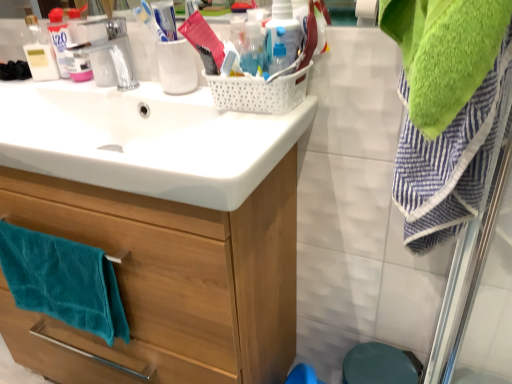
What do you see at coordinates (278, 55) in the screenshot?
I see `translucent plastic bottle at upper center, placed as the second bottle when sorted from left to right` at bounding box center [278, 55].

In order to click on wooden cabinet at center in this screenshot , I will do `click(169, 281)`.

Considering the relative positions of translucent plastic bottle at upper center, which is the first bottle in left-to-right order, and translucent plastic bottle at upper center, placed as the second bottle when sorted from left to right, in the image provided, is translucent plastic bottle at upper center, which is the first bottle in left-to-right order, in front of translucent plastic bottle at upper center, placed as the second bottle when sorted from left to right,?

That is False.

Considering the positions of objects translucent plastic bottle at upper center, the second bottle viewed from the right, and translucent plastic bottle at upper center, placed as the second bottle when sorted from left to right, in the image provided, who is more to the left, translucent plastic bottle at upper center, the second bottle viewed from the right, or translucent plastic bottle at upper center, placed as the second bottle when sorted from left to right,?

translucent plastic bottle at upper center, the second bottle viewed from the right.

Considering the sizes of translucent plastic bottle at upper center, which is the first bottle in left-to-right order, and translucent plastic bottle at upper center, placed as the second bottle when sorted from left to right, in the image, is translucent plastic bottle at upper center, which is the first bottle in left-to-right order, bigger or smaller than translucent plastic bottle at upper center, placed as the second bottle when sorted from left to right,?

Clearly, translucent plastic bottle at upper center, which is the first bottle in left-to-right order, is larger in size than translucent plastic bottle at upper center, placed as the second bottle when sorted from left to right.

How many degrees apart are the facing directions of translucent plastic bottle at upper center, which is the first bottle in left-to-right order, and translucent plastic bottle at upper center, placed as the second bottle when sorted from left to right?

The angular difference between translucent plastic bottle at upper center, which is the first bottle in left-to-right order, and translucent plastic bottle at upper center, placed as the second bottle when sorted from left to right, is 0.00407 degrees.

Does teal soft towel at lower left turn towards wooden cabinet at center?

No, teal soft towel at lower left does not turn towards wooden cabinet at center.

Do you think teal soft towel at lower left is within wooden cabinet at center, or outside of it?

teal soft towel at lower left is not inside wooden cabinet at center, it's outside.

Can you confirm if teal soft towel at lower left is positioned to the left of wooden cabinet at center?

Yes, teal soft towel at lower left is to the left of wooden cabinet at center.

From the image's perspective, which is below, teal soft towel at lower left or wooden cabinet at center?

wooden cabinet at center, from the image's perspective.

The width and height of the screenshot is (512, 384). In the image, there is a teal soft towel at lower left. Identify the location of sink above it (from the image's perspective). (145, 140).

From the image's perspective, who appears lower, white glossy sink at upper center or teal soft towel at lower left?

From the image's view, teal soft towel at lower left is below.

Who is shorter, white glossy sink at upper center or teal soft towel at lower left?

white glossy sink at upper center is shorter.

Who is more distant, white glossy sink at upper center or translucent plastic bottle at upper center, which is the first bottle in left-to-right order?

Positioned behind is translucent plastic bottle at upper center, which is the first bottle in left-to-right order.

Is white glossy sink at upper center directly adjacent to translucent plastic bottle at upper center, the second bottle viewed from the right?

There is a gap between white glossy sink at upper center and translucent plastic bottle at upper center, the second bottle viewed from the right.

Is point (210, 168) closer to camera compared to point (249, 33)?

That is True.

Between white glossy sink at upper center and translucent plastic bottle at upper center, the second bottle viewed from the right, which one has smaller size?

Smaller between the two is translucent plastic bottle at upper center, the second bottle viewed from the right.

What are the coordinates of `sink that appears on the left of wooden cabinet at center` in the screenshot? It's located at (145, 140).

Is point (192, 129) positioned behind point (287, 322)?

No.

Which of these two, white glossy sink at upper center or wooden cabinet at center, is bigger?

Bigger between the two is wooden cabinet at center.

This screenshot has height=384, width=512. I want to click on the 1st bottle above when counting from the teal soft towel at lower left (from the image's perspective), so click(278, 55).

Would you say translucent plastic bottle at upper center, placed as the second bottle when sorted from left to right, is to the left or to the right of teal soft towel at lower left in the picture?

translucent plastic bottle at upper center, placed as the second bottle when sorted from left to right, is to the right of teal soft towel at lower left.

Is translucent plastic bottle at upper center, placed as the second bottle when sorted from left to right, positioned in front of teal soft towel at lower left?

Yes.

Looking at their sizes, would you say translucent plastic bottle at upper center, the 1th bottle from the right, is wider or thinner than teal soft towel at lower left?

translucent plastic bottle at upper center, the 1th bottle from the right, is thinner than teal soft towel at lower left.

From the image's perspective, which one is positioned higher, wooden cabinet at center or translucent plastic bottle at upper center, which is the first bottle in left-to-right order?

translucent plastic bottle at upper center, which is the first bottle in left-to-right order.

Is wooden cabinet at center taller than translucent plastic bottle at upper center, which is the first bottle in left-to-right order?

Correct, wooden cabinet at center is much taller as translucent plastic bottle at upper center, which is the first bottle in left-to-right order.

Would you consider wooden cabinet at center to be distant from translucent plastic bottle at upper center, the second bottle viewed from the right?

No, wooden cabinet at center is not far from translucent plastic bottle at upper center, the second bottle viewed from the right.

Is translucent plastic bottle at upper center, which is the first bottle in left-to-right order, inside wooden cabinet at center?

No, wooden cabinet at center does not contain translucent plastic bottle at upper center, which is the first bottle in left-to-right order.

I want to click on bottle on the right of the translucent plastic bottle at upper center, which is the first bottle in left-to-right order, so click(x=278, y=55).

You are a GUI agent. You are given a task and a screenshot of the screen. Output one action in this format:
    pyautogui.click(x=<x>, y=<y>)
    Task: Click on the bath towel that appears above the wooden cabinet at center (from a real-world perspective)
    Image resolution: width=512 pixels, height=384 pixels.
    Given the screenshot: What is the action you would take?
    pyautogui.click(x=63, y=281)

Considering their positions, is white glossy sink at upper center positioned closer to wooden cabinet at center than teal soft towel at lower left?

teal soft towel at lower left lies closer to wooden cabinet at center than the other object.

Estimate the real-world distances between objects in this image. Which object is further from translucent plastic bottle at upper center, the second bottle viewed from the right, white glossy sink at upper center or wooden cabinet at center?

Among the two, wooden cabinet at center is located further to translucent plastic bottle at upper center, the second bottle viewed from the right.

Considering their positions, is translucent plastic bottle at upper center, placed as the second bottle when sorted from left to right, positioned further to translucent plastic bottle at upper center, which is the first bottle in left-to-right order, than white glossy sink at upper center?

Based on the image, white glossy sink at upper center appears to be further to translucent plastic bottle at upper center, which is the first bottle in left-to-right order.

When comparing their distances from translucent plastic bottle at upper center, the 1th bottle from the right, does teal soft towel at lower left or wooden cabinet at center seem closer?

The object closer to translucent plastic bottle at upper center, the 1th bottle from the right, is wooden cabinet at center.

Estimate the real-world distances between objects in this image. Which object is closer to teal soft towel at lower left, translucent plastic bottle at upper center, placed as the second bottle when sorted from left to right, or white glossy sink at upper center?

Based on the image, white glossy sink at upper center appears to be nearer to teal soft towel at lower left.

Estimate the real-world distances between objects in this image. Which object is further from wooden cabinet at center, teal soft towel at lower left or white glossy sink at upper center?

white glossy sink at upper center is further to wooden cabinet at center.

Considering their positions, is wooden cabinet at center positioned further to translucent plastic bottle at upper center, which is the first bottle in left-to-right order, than white glossy sink at upper center?

wooden cabinet at center.

When comparing their distances from translucent plastic bottle at upper center, the second bottle viewed from the right, does translucent plastic bottle at upper center, placed as the second bottle when sorted from left to right, or teal soft towel at lower left seem further?

teal soft towel at lower left is positioned further to the anchor translucent plastic bottle at upper center, the second bottle viewed from the right.

The height and width of the screenshot is (384, 512). What are the coordinates of `bath towel between translucent plastic bottle at upper center, placed as the second bottle when sorted from left to right, and wooden cabinet at center in the up-down direction` in the screenshot? It's located at (63, 281).

Find the location of `sink located between teal soft towel at lower left and translucent plastic bottle at upper center, the 1th bottle from the right, in the left-right direction`. sink located between teal soft towel at lower left and translucent plastic bottle at upper center, the 1th bottle from the right, in the left-right direction is located at coordinates (145, 140).

This screenshot has height=384, width=512. In order to click on bottle located between white glossy sink at upper center and translucent plastic bottle at upper center, placed as the second bottle when sorted from left to right, in the left-right direction in this screenshot , I will do `click(252, 49)`.

Find the location of a particular element. This screenshot has height=384, width=512. bath towel between white glossy sink at upper center and wooden cabinet at center in the up-down direction is located at coordinates (63, 281).